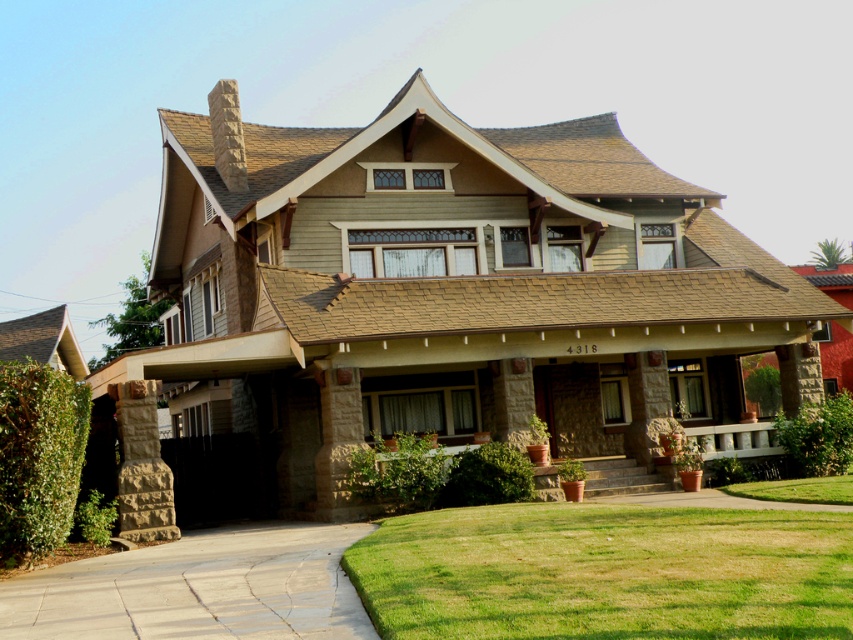
You are planning to install a new garden in your yard. You have two areas to choose from, the green grass at lower center and the smooth concrete driveway at lower left. Which area has more space for planting?

The smooth concrete driveway at lower left has more space for planting because it is larger than the green grass at lower center.

You are planning to install a new garden bed between the green grass at lower center and the smooth concrete driveway at lower left. Which area has more space to accommodate the garden bed?

The smooth concrete driveway at lower left has a greater width than the green grass at lower center, so it can accommodate the garden bed better.